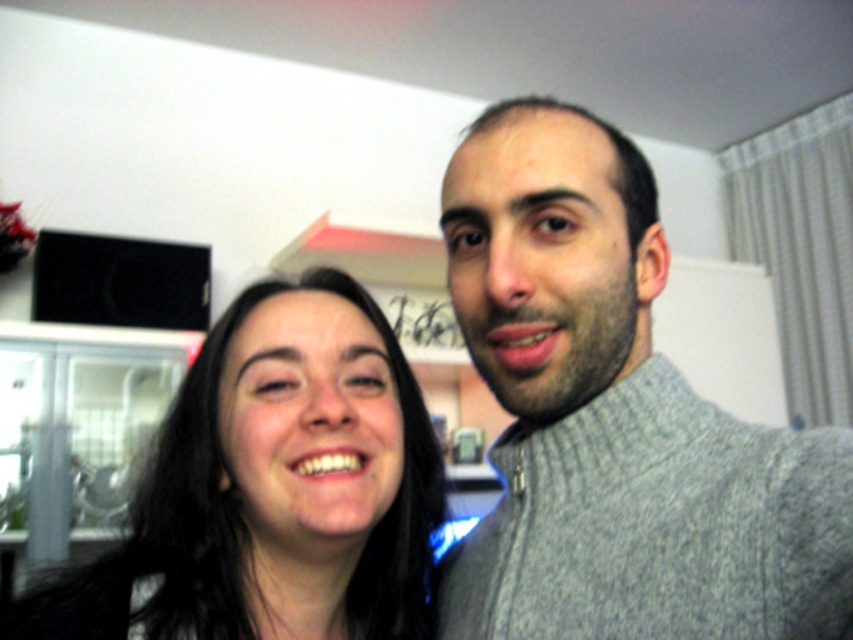
You are standing in the kitchen and want to place a new decorative item on the surface between the two points labeled point (842, 474) and point (294, 429). Based on their positions, which point is closer to you where you should place the item?

Point (842, 474) is closer to the viewer than point (294, 429), so you should place the item closer to point (842, 474).

From the picture: You are a photographer setting up a shoot in a kitchen. You notice the gray knitted sweater at center and the smooth black hair at center. Which object should you adjust your camera focus on if you want to capture the one that is positioned higher in the frame?

The gray knitted sweater at center is above the smooth black hair at center, so you should focus on the gray knitted sweater at center to capture the higher positioned object.